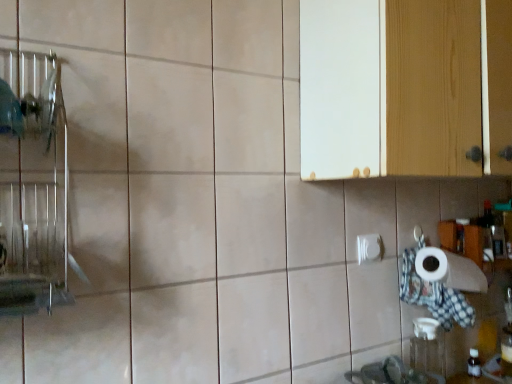
Where is `white glossy toilet paper at lower right`? The image size is (512, 384). white glossy toilet paper at lower right is located at coordinates (369, 248).

Image resolution: width=512 pixels, height=384 pixels. Describe the element at coordinates (369, 248) in the screenshot. I see `white glossy toilet paper at lower right` at that location.

Measure the distance between white glossy toilet paper at lower right and camera.

white glossy toilet paper at lower right and camera are 1.23 meters apart from each other.

Describe the element at coordinates (405, 87) in the screenshot. This screenshot has width=512, height=384. I see `white wood cabinet at upper right` at that location.

The width and height of the screenshot is (512, 384). I want to click on white wood cabinet at upper right, so click(405, 87).

You are a GUI agent. You are given a task and a screenshot of the screen. Output one action in this format:
    pyautogui.click(x=<x>, y=<y>)
    Task: Click on the white glossy toilet paper at lower right
    This screenshot has width=512, height=384.
    Given the screenshot: What is the action you would take?
    pyautogui.click(x=369, y=248)

Is white glossy toilet paper at lower right at the left side of white wood cabinet at upper right?

Correct, you'll find white glossy toilet paper at lower right to the left of white wood cabinet at upper right.

Is white glossy toilet paper at lower right in front of or behind white wood cabinet at upper right in the image?

In the image, white glossy toilet paper at lower right appears behind white wood cabinet at upper right.

Between point (361, 247) and point (339, 150), which one is positioned in front?

The point (339, 150) is closer.

From the image's perspective, which object appears higher, white glossy toilet paper at lower right or white wood cabinet at upper right?

white wood cabinet at upper right appears higher in the image.

From a real-world perspective, is white glossy toilet paper at lower right beneath white wood cabinet at upper right?

Indeed, from a real-world perspective, white glossy toilet paper at lower right is positioned beneath white wood cabinet at upper right.

Can you confirm if white glossy toilet paper at lower right is thinner than white wood cabinet at upper right?

Correct, the width of white glossy toilet paper at lower right is less than that of white wood cabinet at upper right.

Considering the sizes of objects white glossy toilet paper at lower right and white wood cabinet at upper right in the image provided, who is shorter, white glossy toilet paper at lower right or white wood cabinet at upper right?

white glossy toilet paper at lower right.

Between white glossy toilet paper at lower right and white wood cabinet at upper right, which one has smaller size?

white glossy toilet paper at lower right is smaller.

Can we say white glossy toilet paper at lower right lies outside white wood cabinet at upper right?

That's correct, white glossy toilet paper at lower right is outside of white wood cabinet at upper right.

Is white glossy toilet paper at lower right not close to white wood cabinet at upper right?

No, white glossy toilet paper at lower right is in close proximity to white wood cabinet at upper right.

Could you tell me if white glossy toilet paper at lower right is turned towards white wood cabinet at upper right?

No, white glossy toilet paper at lower right does not turn towards white wood cabinet at upper right.

The width and height of the screenshot is (512, 384). Identify the location of toilet paper below the white wood cabinet at upper right (from the image's perspective). (369, 248).

Considering the relative positions of white wood cabinet at upper right and white glossy toilet paper at lower right in the image provided, is white wood cabinet at upper right to the left of white glossy toilet paper at lower right from the viewer's perspective?

In fact, white wood cabinet at upper right is to the right of white glossy toilet paper at lower right.

Between white wood cabinet at upper right and white glossy toilet paper at lower right, which one is positioned in front?

Positioned in front is white wood cabinet at upper right.

Does point (387, 149) appear closer or farther from the camera than point (374, 237)?

Point (387, 149) is closer to the camera than point (374, 237).

From the image's perspective, between white wood cabinet at upper right and white glossy toilet paper at lower right, which one is located above?

white wood cabinet at upper right.

From a real-world perspective, is white wood cabinet at upper right on white glossy toilet paper at lower right?

Yes, from a real-world perspective, white wood cabinet at upper right is on top of white glossy toilet paper at lower right.

Can you confirm if white wood cabinet at upper right is wider than white glossy toilet paper at lower right?

Indeed, white wood cabinet at upper right has a greater width compared to white glossy toilet paper at lower right.

Considering the relative sizes of white wood cabinet at upper right and white glossy toilet paper at lower right in the image provided, is white wood cabinet at upper right shorter than white glossy toilet paper at lower right?

No.

Does white wood cabinet at upper right have a smaller size compared to white glossy toilet paper at lower right?

No.

Can we say white wood cabinet at upper right lies outside white glossy toilet paper at lower right?

That's correct, white wood cabinet at upper right is outside of white glossy toilet paper at lower right.

From the picture: Is white wood cabinet at upper right next to white glossy toilet paper at lower right and touching it?

white wood cabinet at upper right and white glossy toilet paper at lower right are clearly separated.

Is white wood cabinet at upper right facing towards white glossy toilet paper at lower right?

No, white wood cabinet at upper right does not turn towards white glossy toilet paper at lower right.

What's the angular difference between white wood cabinet at upper right and white glossy toilet paper at lower right's facing directions?

The angular difference between white wood cabinet at upper right and white glossy toilet paper at lower right is 2.15 degrees.

How distant is white wood cabinet at upper right from white glossy toilet paper at lower right?

white wood cabinet at upper right and white glossy toilet paper at lower right are 47.08 centimeters apart from each other.

This screenshot has width=512, height=384. I want to click on cabinetry to the right of white glossy toilet paper at lower right, so click(x=405, y=87).

Where is `cabinetry located in front of the white glossy toilet paper at lower right`? Image resolution: width=512 pixels, height=384 pixels. cabinetry located in front of the white glossy toilet paper at lower right is located at coordinates (405, 87).

The height and width of the screenshot is (384, 512). Identify the location of cabinetry on the right of white glossy toilet paper at lower right. (405, 87).